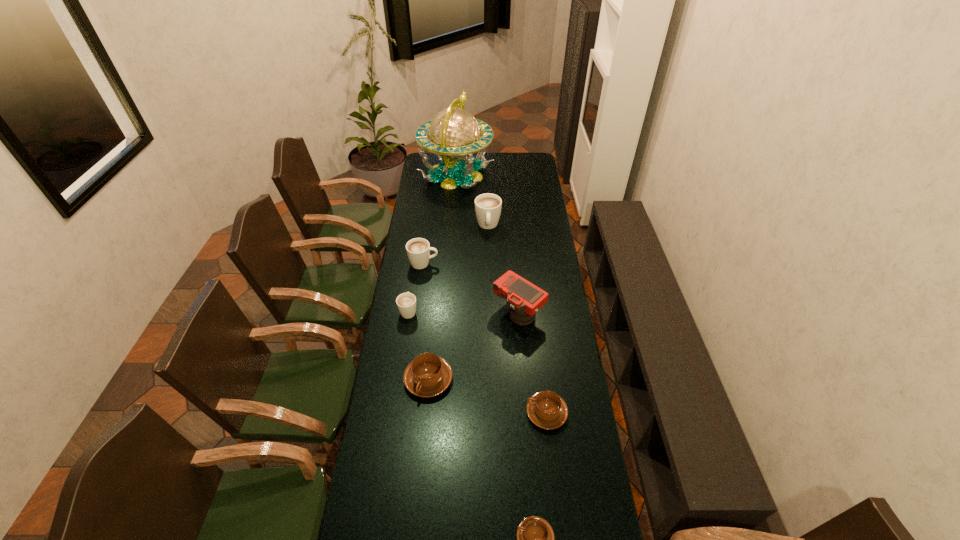
Identify the location of the second smallest brown cappuccino. The image size is (960, 540). (547, 410).

Where is `vacant region located on the front of the tallest object`? vacant region located on the front of the tallest object is located at coordinates (453, 221).

Locate an element on the screen. This screenshot has height=540, width=960. vacant space located 0.180m on the front of the camera is located at coordinates (523, 370).

Identify the location of vacant space positioned with the handle on the side of the rightmost white cappuccino. (490, 283).

Identify the location of vacant region located with the handle on the side of the second nearest white cappuccino. (500, 264).

Where is `vacant space located 0.190m on the side of the biggest brown cappuccino with the handle`? The height and width of the screenshot is (540, 960). vacant space located 0.190m on the side of the biggest brown cappuccino with the handle is located at coordinates (421, 454).

Identify the location of free location located with the handle on the side of the smallest white cappuccino. (415, 271).

Locate an element on the screen. The width and height of the screenshot is (960, 540). vacant space located 0.250m with the handle on the side of the smallest white cappuccino is located at coordinates (416, 262).

Where is `vacant space located 0.220m with the handle on the side of the smallest white cappuccino`? vacant space located 0.220m with the handle on the side of the smallest white cappuccino is located at coordinates (416, 267).

In order to click on vacant space located 0.330m on the side of the second smallest brown cappuccino with the handle in this screenshot , I will do `click(432, 413)`.